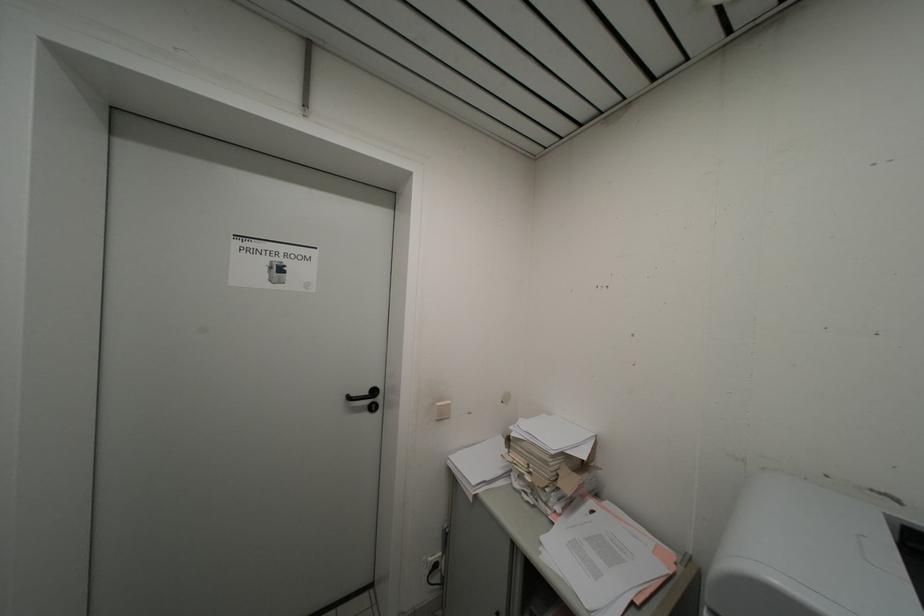
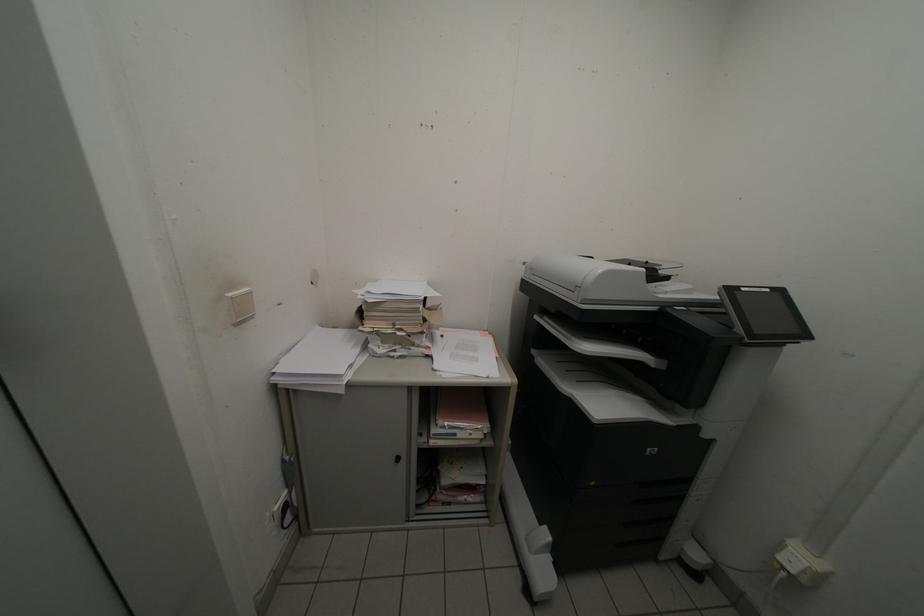
How did the camera likely rotate?

The camera rotated toward right-down.